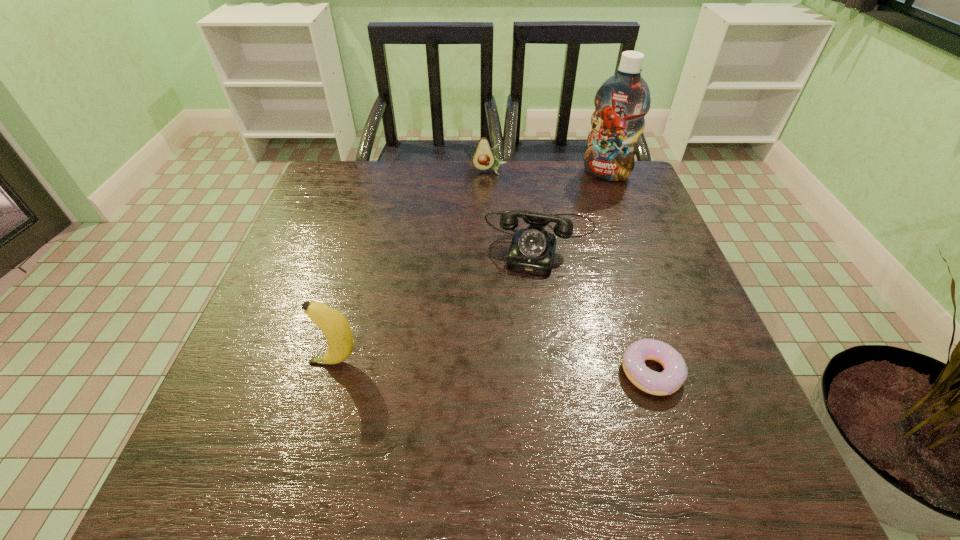
This screenshot has width=960, height=540. What are the coordinates of `free spot on the desktop that is between the second tallest object and the shortest object and is positioned on the front-facing side of the telephone` in the screenshot? It's located at (516, 368).

The width and height of the screenshot is (960, 540). I want to click on free space on the desktop that is between the second tallest object and the shortest object and is positioned on the front label of the tallest object, so click(510, 368).

You are a GUI agent. You are given a task and a screenshot of the screen. Output one action in this format:
    pyautogui.click(x=<x>, y=<y>)
    Task: Click on the vacant space on the desktop that is between the leftmost object and the doughnut and is positioned on the seed side of the avocado
    The image size is (960, 540).
    Given the screenshot: What is the action you would take?
    pyautogui.click(x=518, y=368)